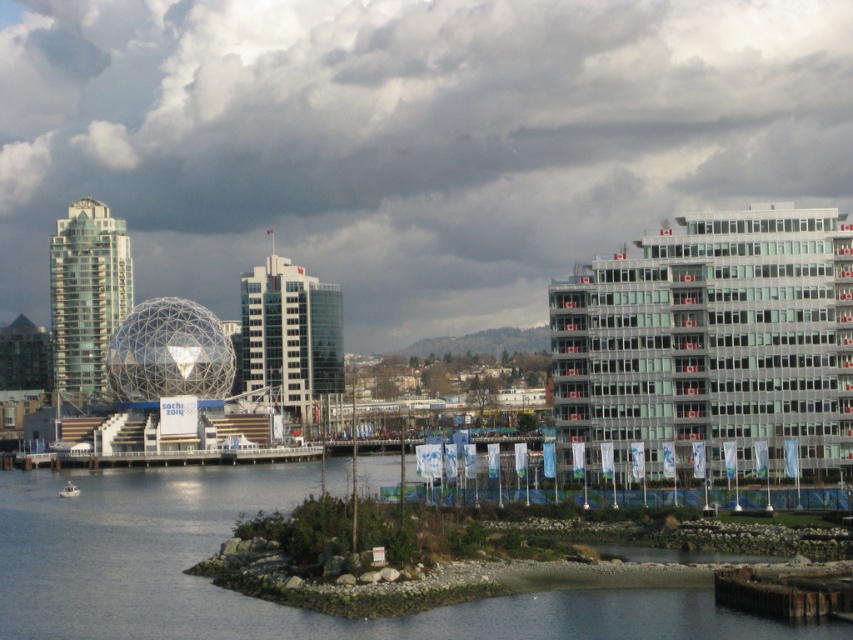
You are standing on the rocky island with sparse vegetation and want to look at the white fluffy cloud at upper center and the white plastic boat at lower left. Which object is higher from the ground?

The white fluffy cloud at upper center is above the white plastic boat at lower left, so the white fluffy cloud at upper center is higher from the ground.

You are a photographer planning to capture the white plastic boat at lower left and the white fluffy cloud at upper center in a single shot. Can you ensure the boat is not obscured by the cloud?

The white plastic boat at lower left is behind the white fluffy cloud at upper center, so the boat will be obscured by the cloud in the photo.